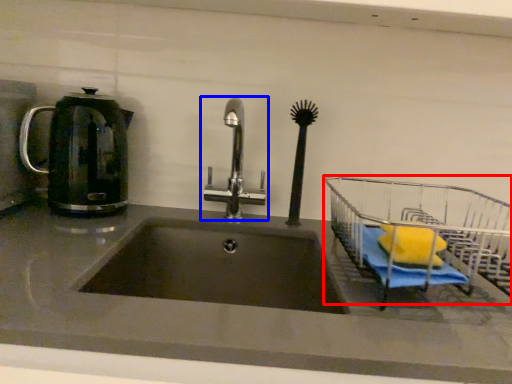
Question: Among these objects, which one is farthest to the camera, cart (highlighted by a red box) or tap (highlighted by a blue box)?

Choices:
 (A) cart
 (B) tap

Answer: (B)